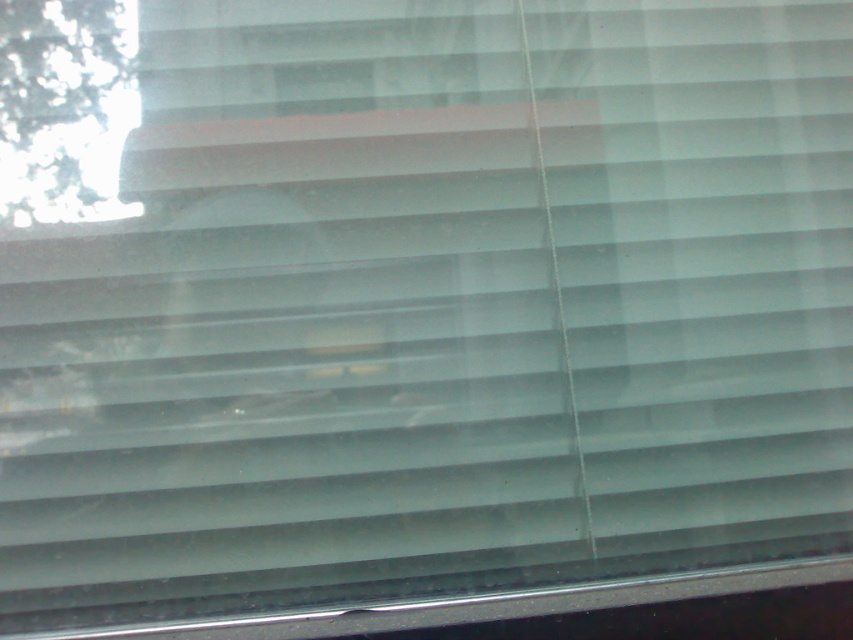
You are standing in a room with the window shown. You want to hang a small bird feeder outside the window so that it can be seen from both the green leafy tree at upper left and the metallic silver window sill at lower center. Based on their heights, which object would the bird feeder need to be positioned closer to?

The green leafy tree at upper left is taller than the metallic silver window sill at lower center. To ensure visibility from both, the bird feeder should be positioned closer to the green leafy tree at upper left.

You are a window cleaner holding a 1 meter long pole. You need to clean the green leafy tree at upper left and the metallic silver window sill at lower center. Which object can you reach without extending the pole beyond its maximum length?

The metallic silver window sill at lower center can be reached without extending the pole beyond its maximum length because it is closer to you than the green leafy tree at upper left, which is further away.

You are a window cleaner who needs to clean the green leafy tree at upper left and the metallic silver window sill at lower center. Which object should you clean first if you want to start from the highest point?

You should clean the green leafy tree at upper left first because it is located above the metallic silver window sill at lower center, making it the higher point to start with.